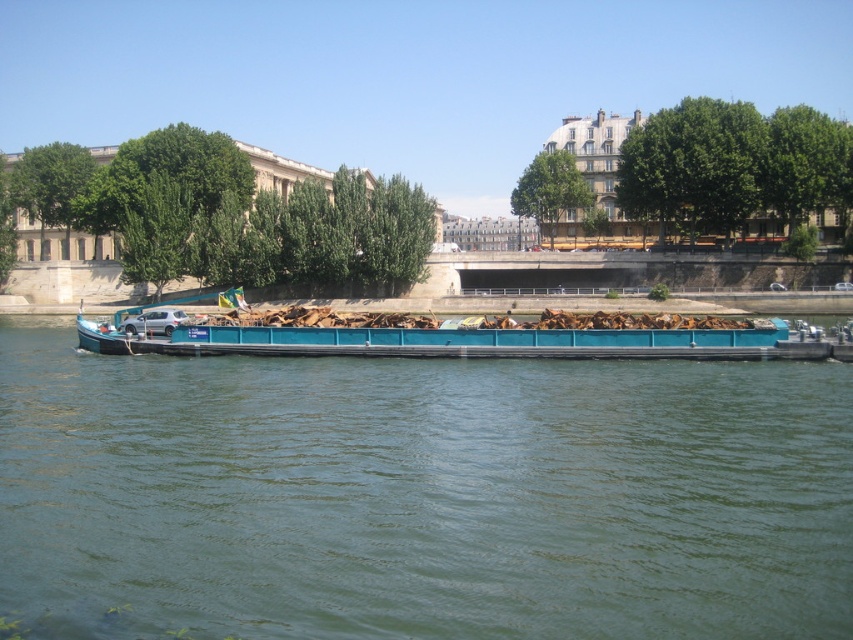
You are a boat inspector who needs to board both the teal metallic barge at center and the teal matte barge at center. Given that your inspection boat can only travel 40 feet before needing to refuel, can you reach both barges without refueling?

The teal metallic barge at center is 43.16 feet from the teal matte barge at center. Since the distance between them exceeds the 40 feet travel range of your inspection boat, you cannot reach both barges without refueling.

You are standing on the riverside path and see both the teal metallic barge at center and the teal matte barge at center. Which one is positioned to the left?

The teal metallic barge at center is positioned to the left of the teal matte barge at center.

You are standing on the riverside and see two barges in the water. The teal metallic barge at center and the teal matte barge at center. Which one is positioned lower in the image?

The teal metallic barge at center is positioned lower than the teal matte barge at center in the image.